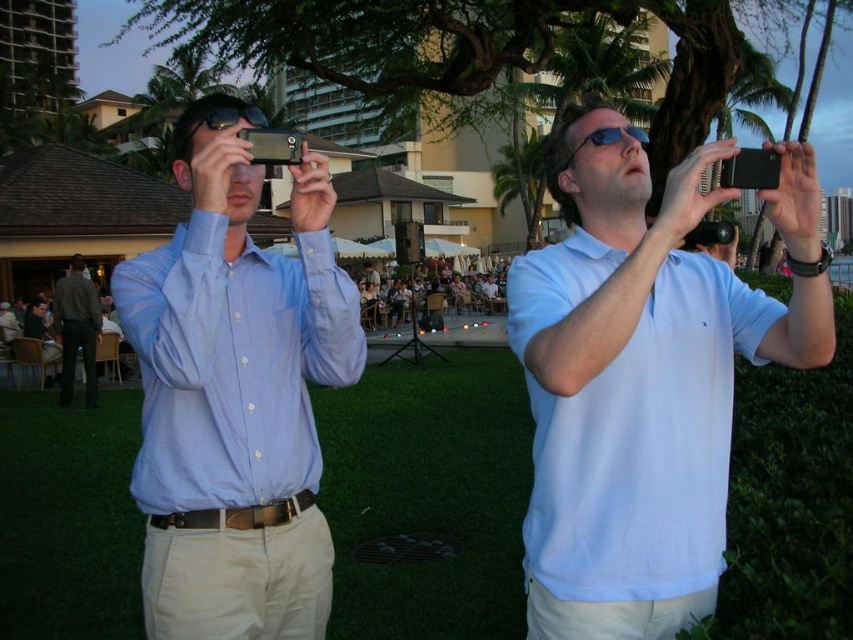
What are the coordinates of the light blue cotton polo shirt at upper right?

The light blue cotton polo shirt at upper right is located at point (645,445).

You are a photographer trying to capture the scene where the two men are taking photos. You want to ensure that the light blue button down shirt at left is visible in your shot. Where should you position your camera relative to the point at (x=231, y=364)?

The light blue button down shirt at left is located at the point (x=231, y=364), so positioning the camera near that coordinate will ensure it is visible in the shot.

You are standing at point point (215, 396) and want to take a photo of the camera. The camera is 2.68 meters away from you. If you have a camera with a 50mm lens, will you be able to capture the entire camera in your photo without moving?

The distance between you and the camera is 2.68 meters. With a 50mm lens, the field of view is approximately 46 degrees. To capture the entire camera, ensure it fits within this angle. However, without knowing the camera size, it is difficult to confirm. Consider moving closer or using a wider lens for better results.